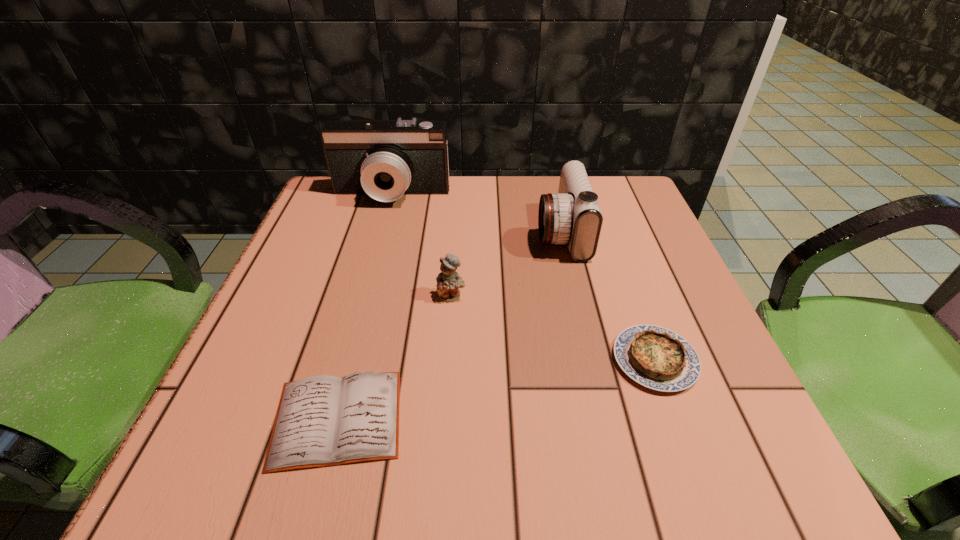
In order to click on the tallest object in this screenshot , I will do `click(385, 159)`.

I want to click on the taller camcorder, so click(x=385, y=159).

Locate an element on the screen. The height and width of the screenshot is (540, 960). the shorter camcorder is located at coordinates (572, 216).

Locate an element on the screen. The image size is (960, 540). the right camcorder is located at coordinates (572, 216).

This screenshot has width=960, height=540. I want to click on teddy bear, so click(448, 281).

Locate an element on the screen. The height and width of the screenshot is (540, 960). the third tallest object is located at coordinates point(448,281).

The image size is (960, 540). Find the location of `the fourth tallest object`. the fourth tallest object is located at coordinates (655, 357).

Find the location of `the shortest object`. the shortest object is located at coordinates (321, 421).

Where is `vacant space located on the lens of the left camcorder`? The width and height of the screenshot is (960, 540). vacant space located on the lens of the left camcorder is located at coordinates (355, 327).

You are a GUI agent. You are given a task and a screenshot of the screen. Output one action in this format:
    pyautogui.click(x=<x>, y=<y>)
    Task: Click on the free space located 0.310m on the surface of the shorter camcorder
    
    Given the screenshot: What is the action you would take?
    pyautogui.click(x=396, y=233)